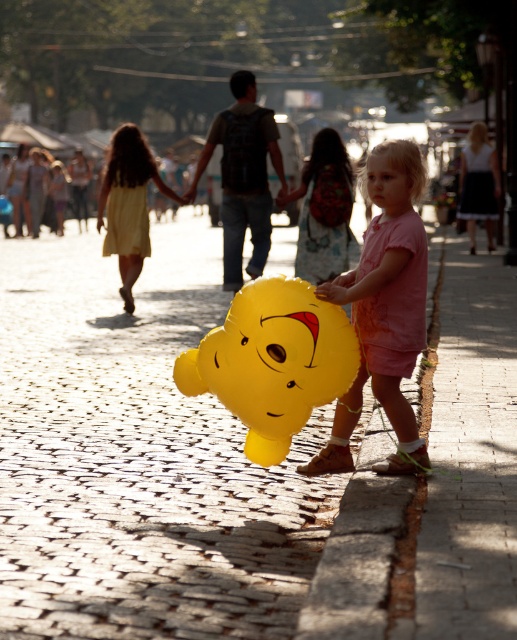
Question: Is pink matte dress at center further to camera compared to yellow matte balloon at center?

Choices:
 (A) yes
 (B) no

Answer: (B)

Question: Which point is farther to the camera?

Choices:
 (A) (134, 276)
 (B) (388, 337)

Answer: (A)

Question: Does yellow matte balloon at center appear over smooth skin face at center?

Choices:
 (A) yes
 (B) no

Answer: (A)

Question: Which is farther from the yellow rubber balloon at center?

Choices:
 (A) pink matte dress at center
 (B) yellow matte balloon at center
 (C) smooth skin face at center
 (D) yellow balloon at center

Answer: (B)

Question: Which point appears farthest from the camera in this image?

Choices:
 (A) (386, 301)
 (B) (493, 609)

Answer: (A)

Question: Does yellow balloon at center lie behind smooth skin face at center?

Choices:
 (A) no
 (B) yes

Answer: (A)